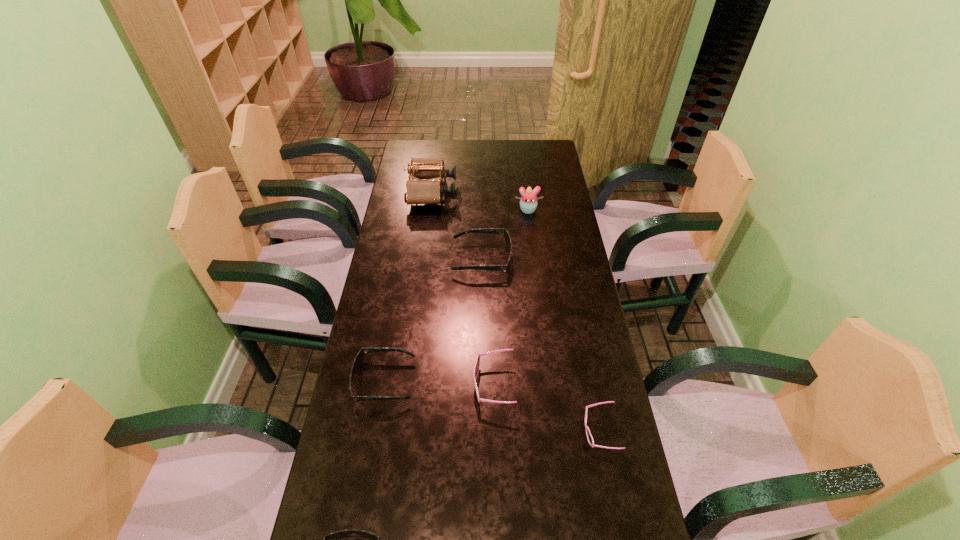
Find the location of a particular element. The width and height of the screenshot is (960, 540). black sunglasses that is the second closest to the second farthest black sunglasses is located at coordinates (506, 235).

Locate which black sunglasses is the closest to the tallest object. Please provide its 2D coordinates. Your answer should be formatted as a tuple, i.e. [(x, y)], where the tuple contains the x and y coordinates of a point satisfying the conditions above.

[(506, 235)]

Identify the location of free location that satisfies the following two spatial constraints: 1. on the face of the sixth object from left to right; 2. on the front-facing side of the second biggest black sunglasses. The image size is (960, 540). (549, 381).

You are a GUI agent. You are given a task and a screenshot of the screen. Output one action in this format:
    pyautogui.click(x=<x>, y=<y>)
    Task: Click on the vacant space that satisfies the following two spatial constraints: 1. on the face of the second tallest object; 2. on the front-facing side of the farthest sunglasses
    The height and width of the screenshot is (540, 960).
    Given the screenshot: What is the action you would take?
    pyautogui.click(x=534, y=259)

This screenshot has width=960, height=540. I want to click on free space that satisfies the following two spatial constraints: 1. on the face of the second tallest object; 2. on the front-facing side of the second nearest black sunglasses, so click(549, 381).